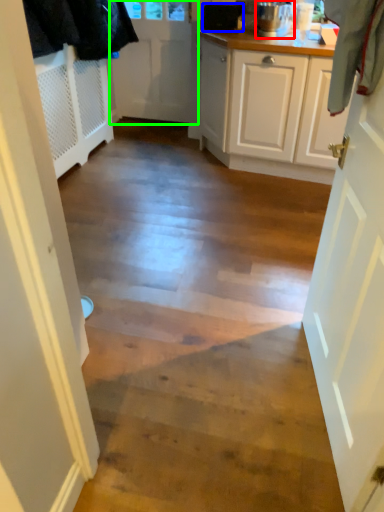
Question: Considering the real-world distances, which object is farthest from kitchen appliance (highlighted by a red box)? appliance (highlighted by a blue box) or door (highlighted by a green box)?

Choices:
 (A) appliance
 (B) door

Answer: (B)